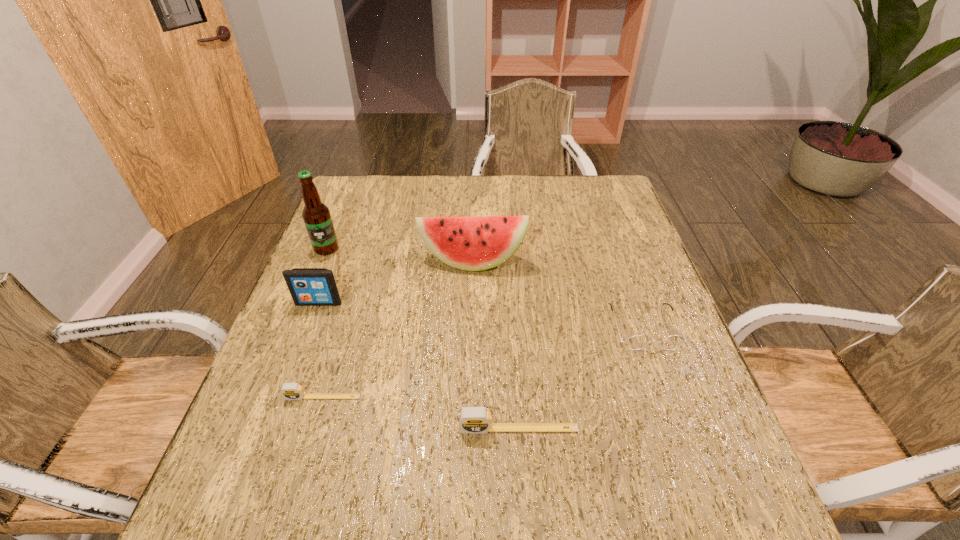
Considering the uniform spacing of tape measures, where should an additional tape measure be positioned on the right? Please locate a free spot. Please provide its 2D coordinates. Your answer should be formatted as a tuple, i.e. [(x, y)], where the tuple contains the x and y coordinates of a point satisfying the conditions above.

[(739, 464)]